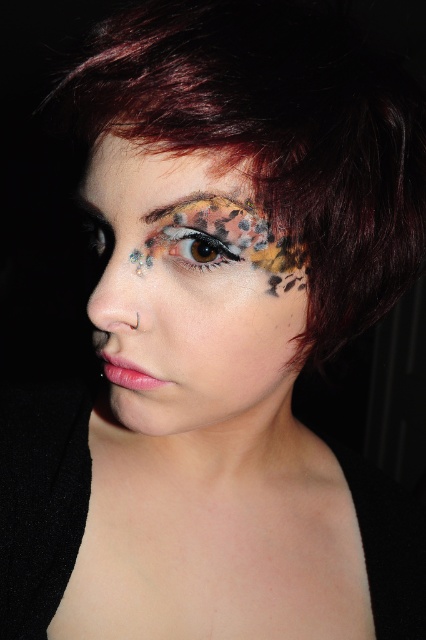
Who is positioned more to the right, multicolored textured eyebrow at upper center or multicolored glitter eye at center?

From the viewer's perspective, multicolored glitter eye at center appears more on the right side.

Which of these two, multicolored textured eyebrow at upper center or multicolored glitter eye at center, stands shorter?

With less height is multicolored textured eyebrow at upper center.

Describe the element at coordinates (209, 214) in the screenshot. Image resolution: width=426 pixels, height=640 pixels. I see `multicolored textured eyebrow at upper center` at that location.

Identify the location of multicolored textured eyebrow at upper center. (209, 214).

Does point (238, 252) come behind point (89, 237)?

That is False.

Between point (224, 244) and point (103, 234), which one is positioned behind?

The point (103, 234) is behind.

What do you see at coordinates (198, 246) in the screenshot?
I see `multicolored glitter eye at center` at bounding box center [198, 246].

Find the location of a particular element. Image resolution: width=426 pixels, height=640 pixels. multicolored glitter eye at center is located at coordinates (198, 246).

Can you confirm if multicolored textured makeup at center is smaller than multicolored glitter eye at center?

Actually, multicolored textured makeup at center might be larger than multicolored glitter eye at center.

This screenshot has height=640, width=426. What do you see at coordinates (190, 292) in the screenshot?
I see `multicolored textured makeup at center` at bounding box center [190, 292].

At what (x,y) coordinates should I click in order to perform the action: click on multicolored textured makeup at center. Please return your answer as a coordinate pair (x, y). The image size is (426, 640). Looking at the image, I should click on (190, 292).